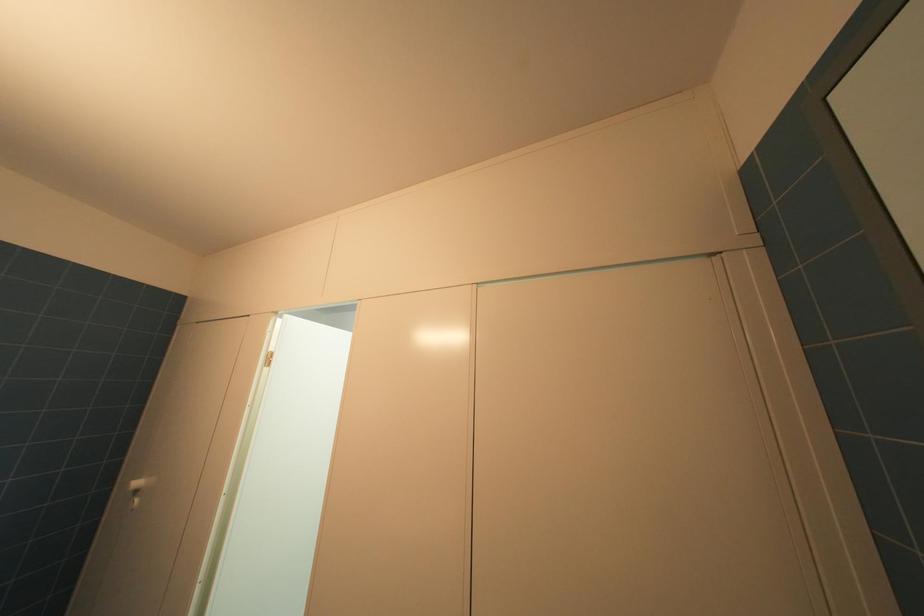
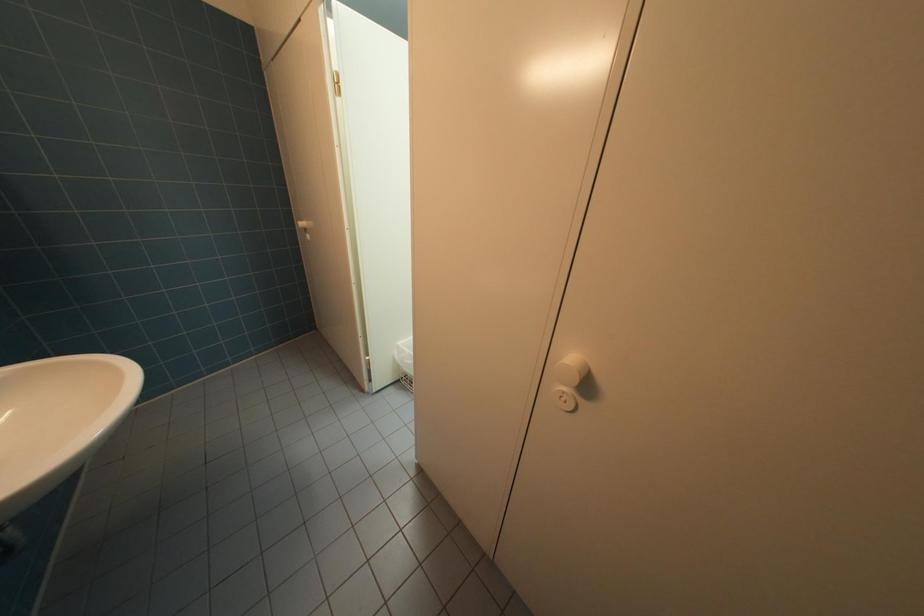
In the scene shown: The first image is from the beginning of the video and the second image is from the end. How did the camera likely rotate when shooting the video?

The camera's rotation is toward left-down.